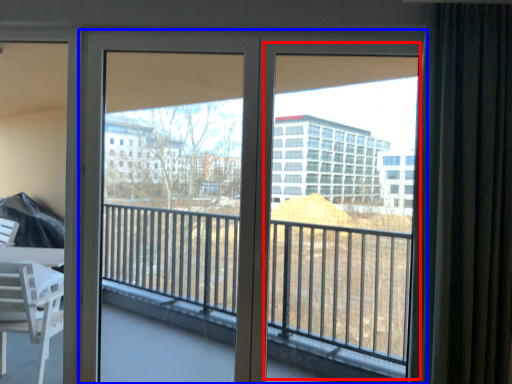
Question: Which object appears farthest to the camera in this image, window screen (highlighted by a red box) or door (highlighted by a blue box)?

Choices:
 (A) window screen
 (B) door

Answer: (B)